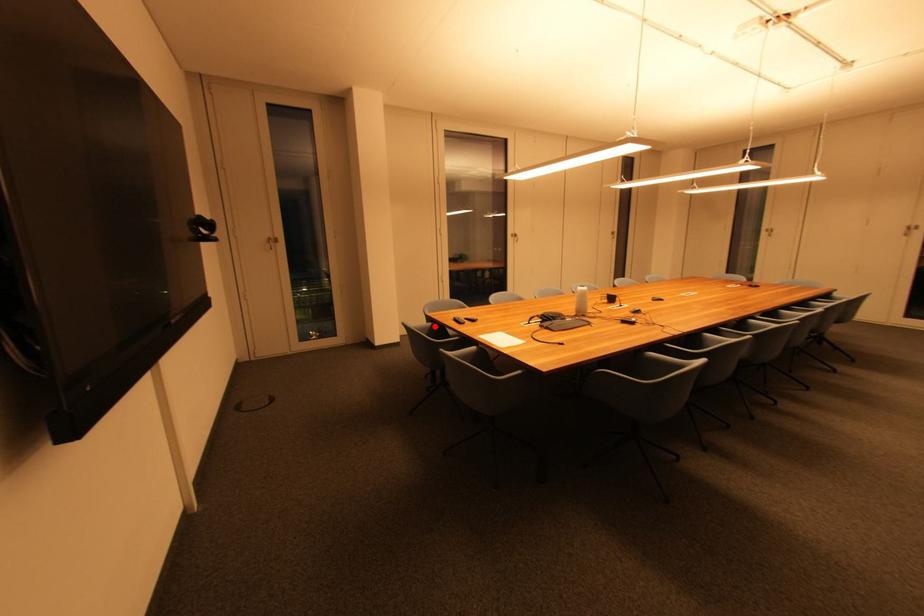
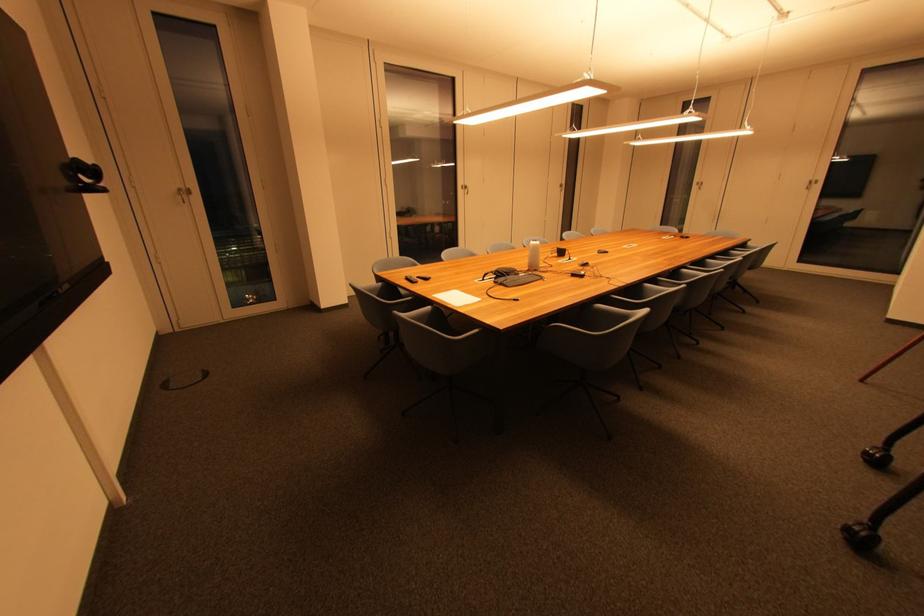
The point at the highlighted location is marked in the first image. Where is the corresponding point in the second image?

(385, 286)